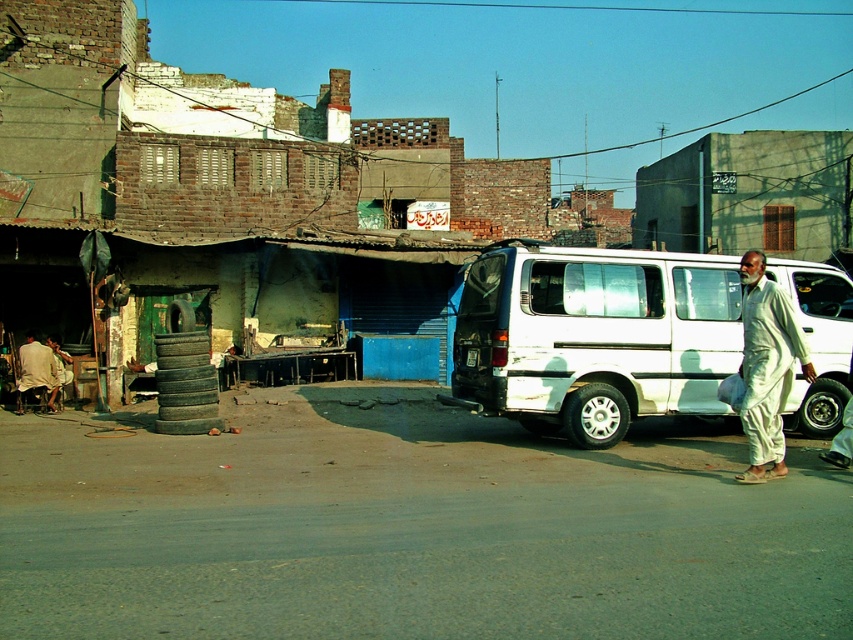
You are a delivery person who needs to unload a package from the white matte van at center. However, there are white cotton pants at right hanging above it. Can you access the van without moving the pants?

The white matte van at center is positioned under the white cotton pants at right, so the pants are hanging above the van. Since the pants are above and not blocking the entrance, you can access the van without moving them.

You are a delivery driver who needs to park your vehicle between the white matte van at center and the green concrete wall at upper right. Based on the scene, can you safely park your vehicle there without blocking the entrance of the workshop?

The white matte van at center is positioned on the left side of the green concrete wall at upper right. Since the van is already parked on the right side of the road and the wall is at the upper right, there might not be enough space between them to park safely without blocking the workshop entrance. It is advisable to look for another parking spot.

You are a tailor who needs to determine which fabric has a greater width to fit a specific project. You see the white cotton pants at right and the light beige fabric at lower left. Which one has a larger width?

The white cotton pants at right has a larger width than the light beige fabric at lower left according to the description.